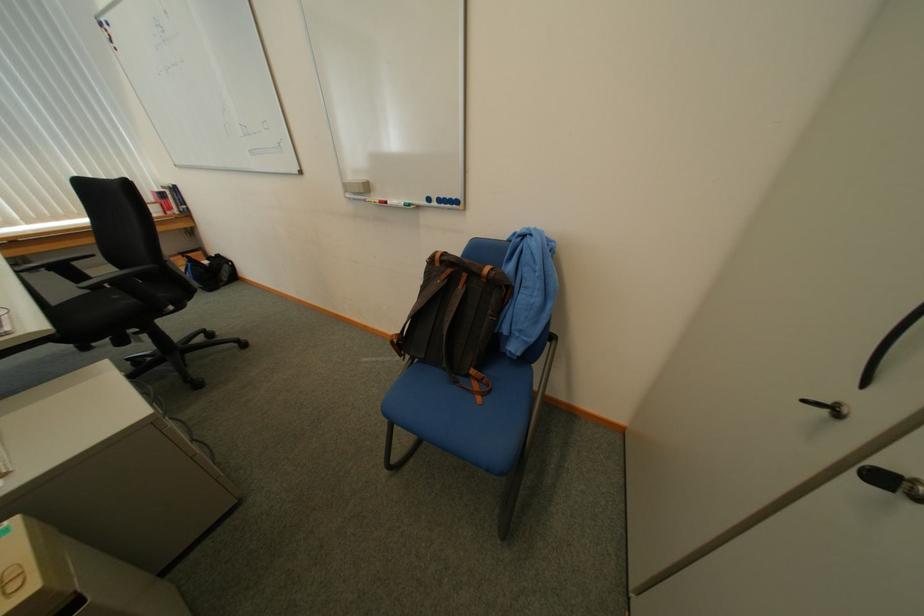
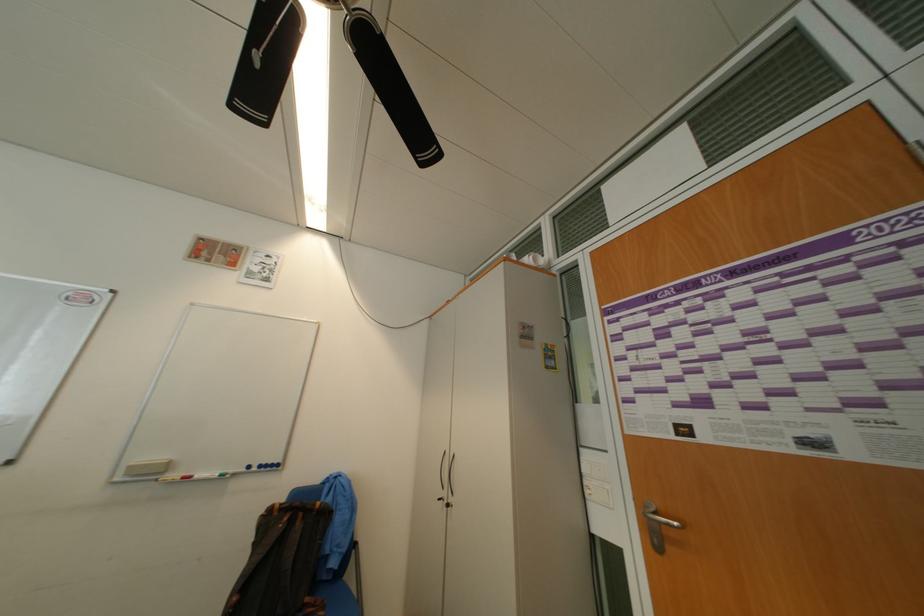
Where in the second image is the point corresponding to pixel 358 197 from the first image?

(128, 480)